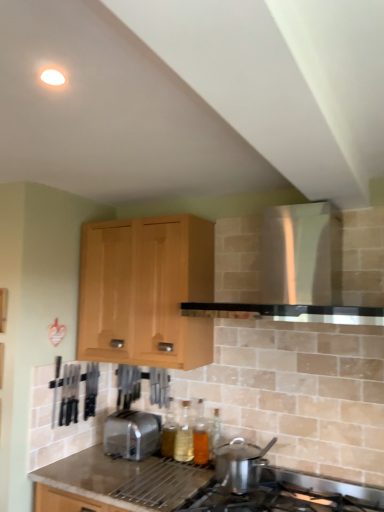
Where is `free point above granite gray countertop at lower center (from a real-world perspective)`? free point above granite gray countertop at lower center (from a real-world perspective) is located at coordinates (130, 472).